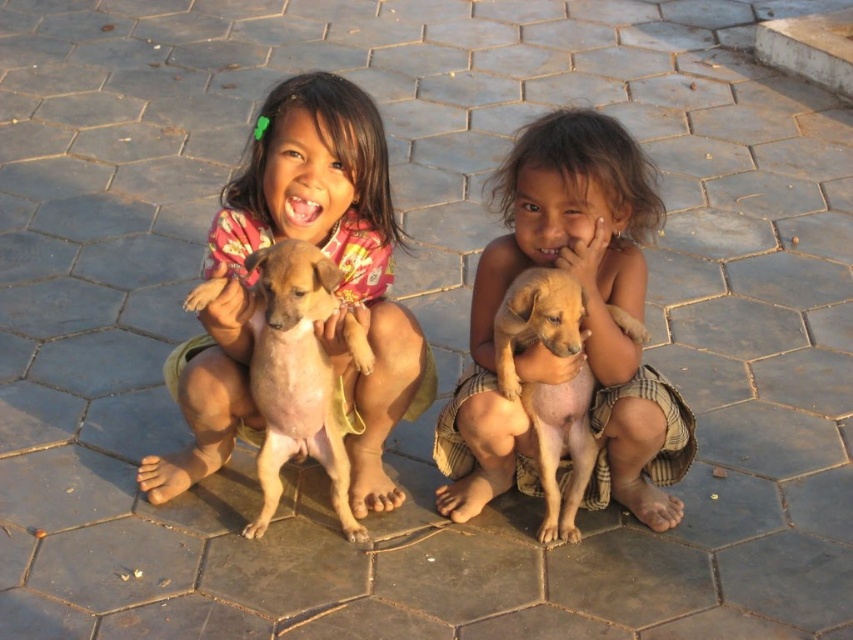
Based on the photo, please provide the coordinates of the brown furry dog at center in the image. The answer should be in the format of a point with two decimal places, such as 0.586, 0.347.

The coordinates of the brown furry dog at center are at point (294, 374).

You are a toy delivery robot that needs to place a 40 cm long stuffed animal between the light brown fur puppy at center and the matte pink shirt at center. Can you fit the stuffed animal in the space between them without overlapping either object?

The distance between the light brown fur puppy at center and the matte pink shirt at center is 37.50 centimeters. Since the stuffed animal is 40 cm long, it cannot fit in the space between them without overlapping either object.

You are standing in front of the two children and want to place a small gift exactly halfway between the point at coordinates point (527, 150) and the point at coordinates point (352, 500). Which child should you approach to ensure the gift is placed closer to them?

The point at coordinates point (527, 150) is closer to the viewer than the point at coordinates point (352, 500). Therefore, placing the gift halfway between them would mean it is closer to the child on the left.